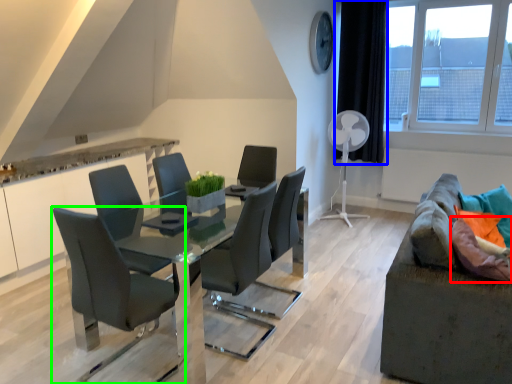
Question: Considering the real-world distances, which object is closest to pillow (highlighted by a red box)? curtain (highlighted by a blue box) or chair (highlighted by a green box).

Choices:
 (A) curtain
 (B) chair

Answer: (B)